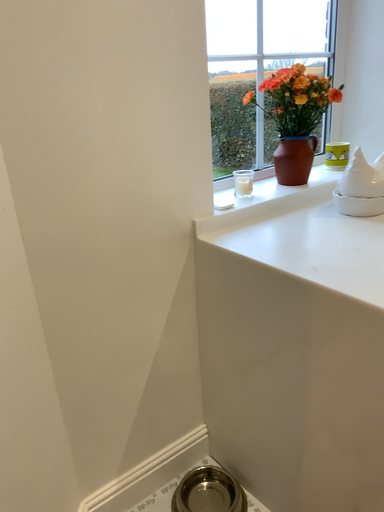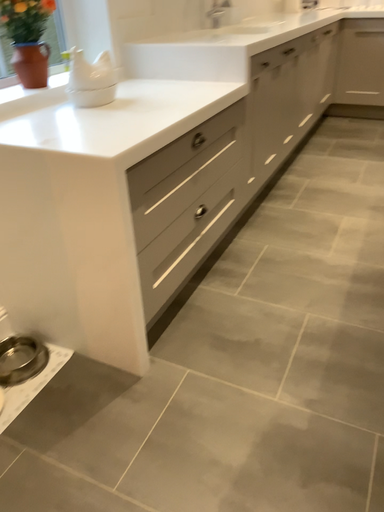
Question: How did the camera likely rotate when shooting the video?

Choices:
 (A) rotated right
 (B) rotated left

Answer: (A)